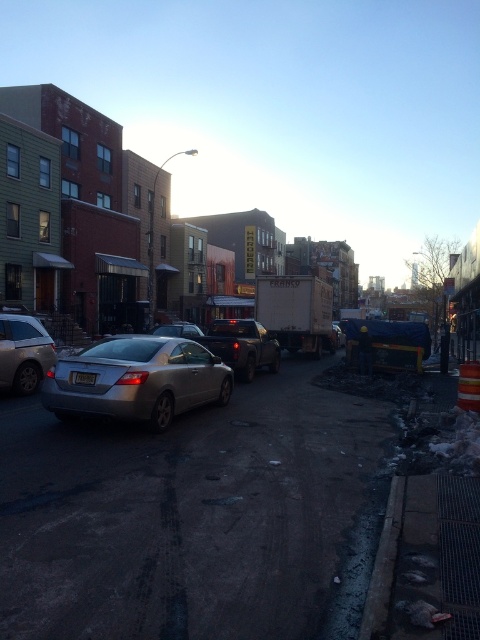
You are a delivery person trying to park your 1.8 meters tall delivery box in the space between the silver metallic sedan at left and the matte black truck at center. Can the delivery box fit vertically between them?

The silver metallic sedan at left is taller than the matte black truck at center. Since the delivery box is 1.8 meters tall, it can fit vertically between them as long as the shorter vehicle is at least 1.8 meters tall. However, without specific height measurements for the vehicles, we cannot confirm if the space is sufficient. The description only states their relative heights, not absolute dimensions.

You are a delivery person trying to park your white van which is 2.5 meters wide. You see the silver metallic sedan at left and the matte black truck at center. Which parking spot can accommodate your van based on the vehicle widths?

The matte black truck at center has a wider width than the silver metallic sedan at left. Since your van is 2.5 meters wide, you should check the parking spot for the matte black truck at center as it might be wider. However, without knowing the exact width of the matte black truck at center, it is uncertain if it will fit.

You are standing on the sidewalk and want to cross the street to reach a cafe on the opposite side. The street has a speed limit of 30 km per hour. Can you safely cross the street in front of the satin silver sedan at center if you walk at a speed of 1.5 meters per second?

The satin silver sedan at center is 7.77 meters away from you. To cross the street safely, you need to ensure that the distance is sufficient. At a walking speed of 1.5 mps, it would take approximately 5.18 seconds to cover 7.77 meters. Considering the street has a speed limit of 30 km per hour, which converts to approximately 8.33 meters per second, the sedan could potentially cover about 42.9 meters in that time. This suggests that the distance is insufficient for safe crossing, so it is not advisable to